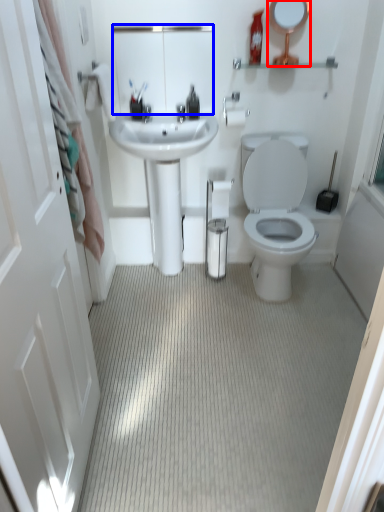
Question: Which of the following is the farthest to the observer, mirror (highlighted by a red box) or mirror (highlighted by a blue box)?

Choices:
 (A) mirror
 (B) mirror

Answer: (B)